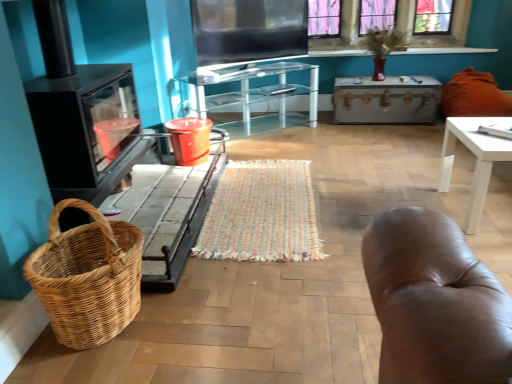
Question: Is pink glass window at upper center at the right side of transparent glass cabinet at center?

Choices:
 (A) yes
 (B) no

Answer: (A)

Question: Does pink glass window at upper center have a smaller size compared to transparent glass cabinet at center?

Choices:
 (A) yes
 (B) no

Answer: (A)

Question: From a real-world perspective, does pink glass window at upper center sit lower than transparent glass cabinet at center?

Choices:
 (A) no
 (B) yes

Answer: (A)

Question: From a real-world perspective, is pink glass window at upper center physically above transparent glass cabinet at center?

Choices:
 (A) no
 (B) yes

Answer: (B)

Question: Does pink glass window at upper center lie behind transparent glass cabinet at center?

Choices:
 (A) yes
 (B) no

Answer: (A)

Question: Is white glossy table at right wider or thinner than beige leather trunk at upper center?

Choices:
 (A) thin
 (B) wide

Answer: (B)

Question: Is white glossy table at right bigger or smaller than beige leather trunk at upper center?

Choices:
 (A) big
 (B) small

Answer: (B)

Question: Choose the correct answer: Is white glossy table at right inside beige leather trunk at upper center or outside it?

Choices:
 (A) outside
 (B) inside

Answer: (A)

Question: Considering the positions of white glossy table at right and beige leather trunk at upper center in the image, is white glossy table at right taller or shorter than beige leather trunk at upper center?

Choices:
 (A) short
 (B) tall

Answer: (B)

Question: From a real-world perspective, is black glass fireplace at left positioned above or below transparent glass cabinet at center?

Choices:
 (A) below
 (B) above

Answer: (B)

Question: In terms of width, does black glass fireplace at left look wider or thinner when compared to transparent glass cabinet at center?

Choices:
 (A) wide
 (B) thin

Answer: (A)

Question: Based on their sizes in the image, would you say black glass fireplace at left is bigger or smaller than transparent glass cabinet at center?

Choices:
 (A) small
 (B) big

Answer: (B)

Question: From the image's perspective, is black glass fireplace at left located above or below transparent glass cabinet at center?

Choices:
 (A) above
 (B) below

Answer: (B)

Question: Considering their positions, is woven multicolored mat at center located in front of or behind white glossy table at right?

Choices:
 (A) front
 (B) behind

Answer: (B)

Question: From the image's perspective, is woven multicolored mat at center above or below white glossy table at right?

Choices:
 (A) below
 (B) above

Answer: (A)